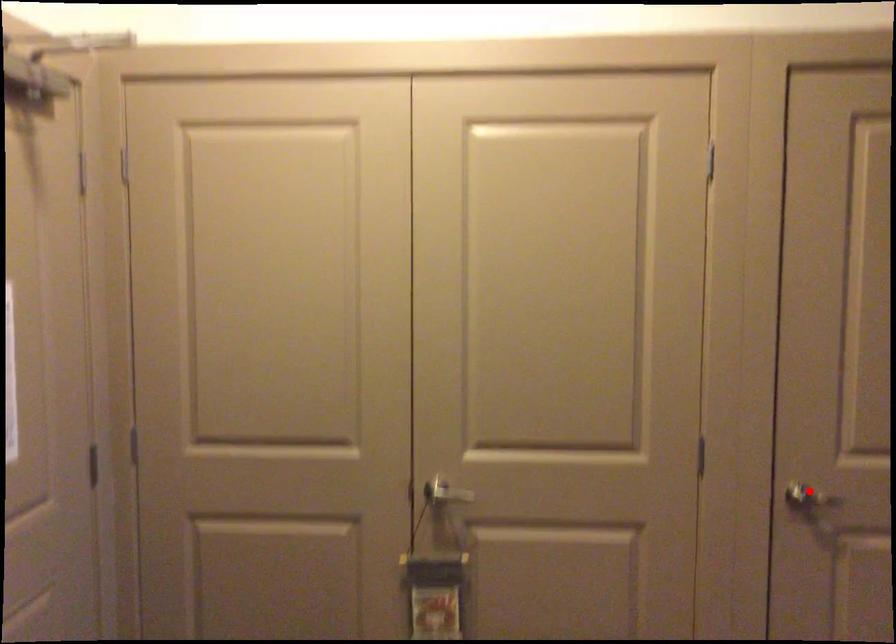
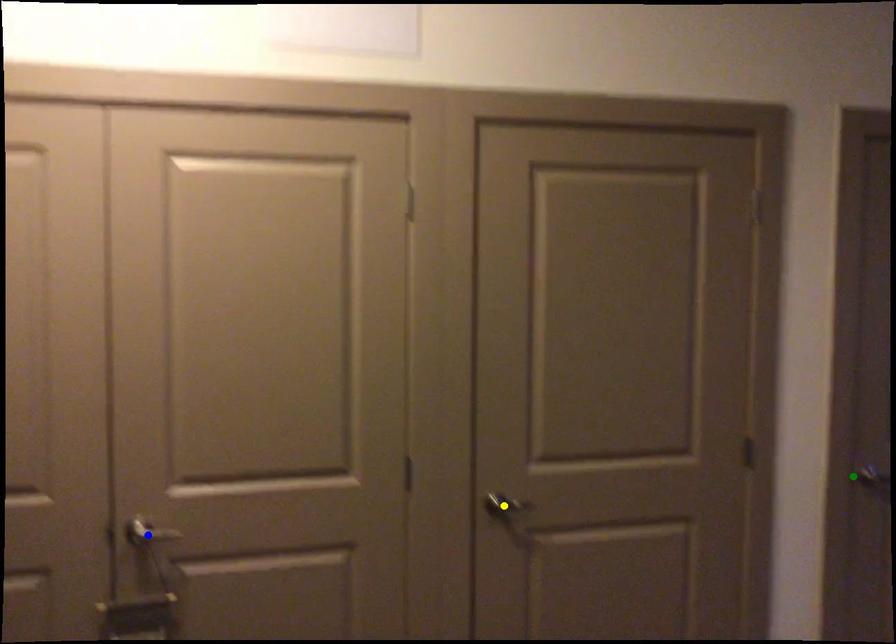
Question: I am providing you with two images of the same scene from different viewpoints. A red point is marked on the first image. You are given multiple points on the second image. Can you choose the point in image 2 that corresponds to the point in image 1?

Choices:
 (A) green point
 (B) yellow point
 (C) blue point

Answer: (B)